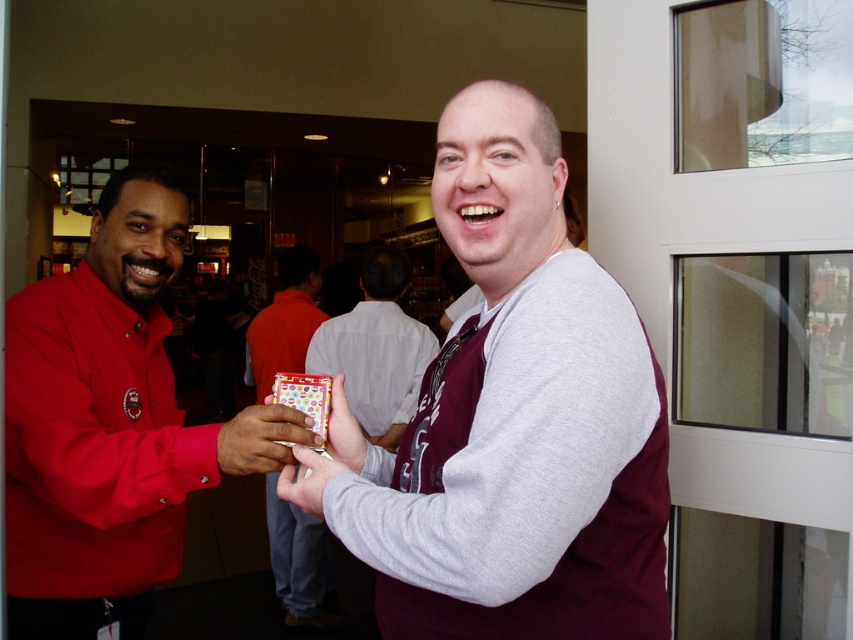
You are a customer at the store and you see the light gray cotton shirt at center and the matte plastic phone at center. Which item is closer to the ground?

The light gray cotton shirt at center is below the matte plastic phone at center, so it is closer to the ground.

You are a customer at the store and see the matte plastic phone at center and the matte plastic card at center being handed to you. Which item is on the left side?

The matte plastic phone at center is positioned on the left side of the matte plastic card at center.